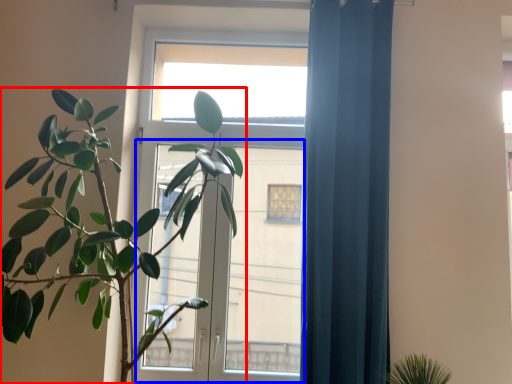
Question: Which of the following is the closest to the observer, houseplant (highlighted by a red box) or screen door (highlighted by a blue box)?

Choices:
 (A) houseplant
 (B) screen door

Answer: (A)